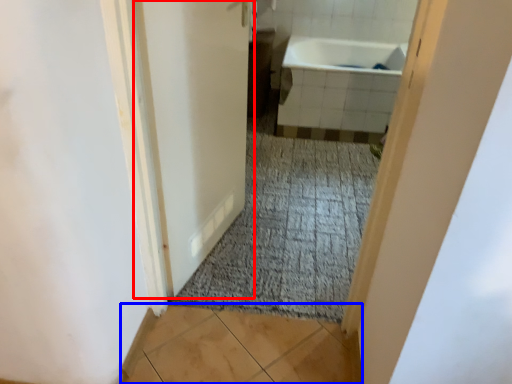
Question: Which object is closer to the camera taking this photo, door (highlighted by a red box) or tile (highlighted by a blue box)?

Choices:
 (A) door
 (B) tile

Answer: (A)